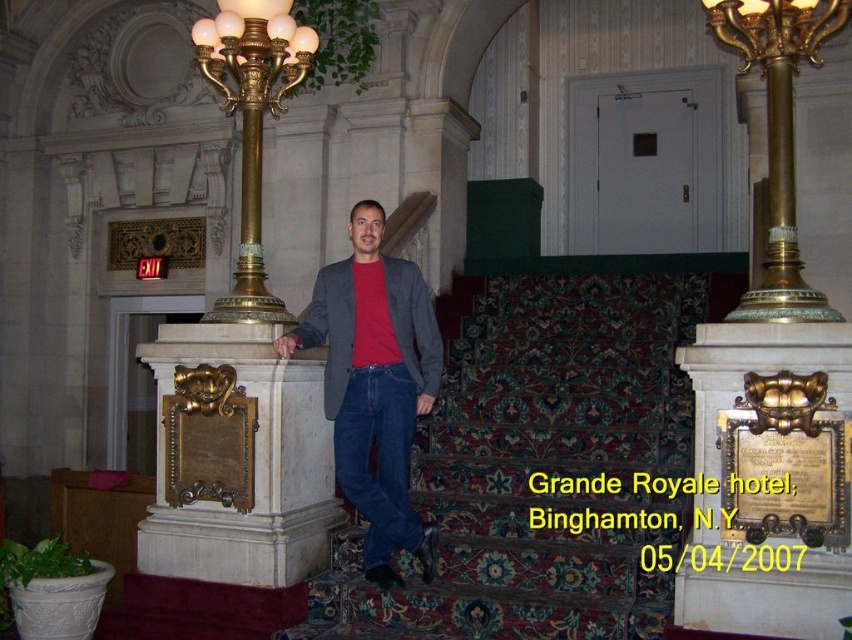
You are a guest at the Grande Royale hotel and want to walk down the carpeted stairs at center while wearing the matte gray blazer at center. Which direction should you face to ensure the stairs are on your right side?

To have the carpeted stairs at center on your right side while wearing the matte gray blazer at center, you should face towards the left since the carpeted stairs at center is positioned on the right side of the matte gray blazer at center according to the description.

You are a photographer trying to capture the man in the gray blazer at center. The camera you are using has a limited field of view and can only focus on objects within a 0.1 unit radius around the point specified. Given that the point representing the matte gray blazer at center is located at coordinates point (375, 385), will your camera be able to focus on the man?

The matte gray blazer at center is represented by point (375, 385). Since the camera can focus within a 0.1 unit radius around the specified point, the camera will successfully focus on the man as the point is within the required range.